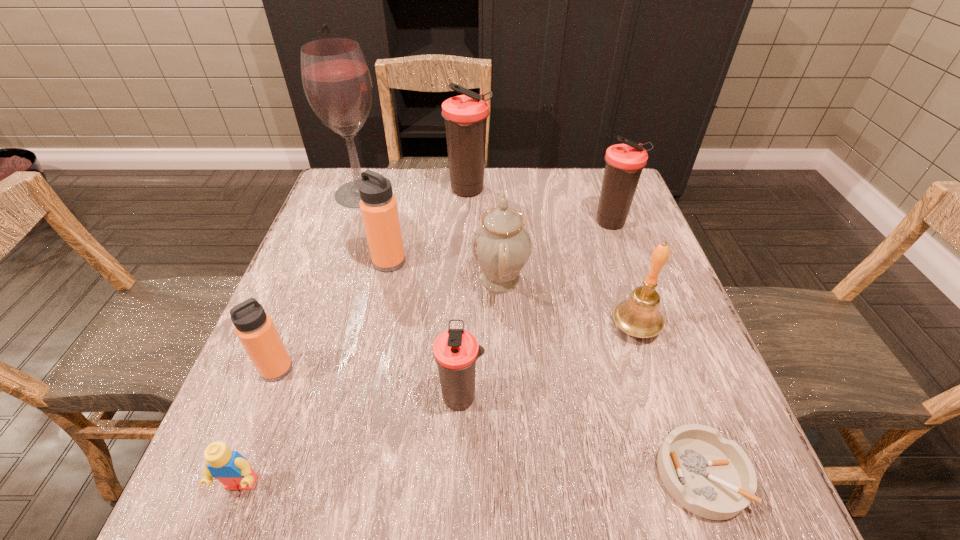
At what (x,y) coordinates should I click in order to perform the action: click on red alcohol. Please return your answer as a coordinate pair (x, y). Looking at the image, I should click on (336, 80).

Identify the location of the tallest object. Image resolution: width=960 pixels, height=540 pixels. (336, 80).

The height and width of the screenshot is (540, 960). I want to click on the farthest thermos bottle, so click(465, 115).

The width and height of the screenshot is (960, 540). I want to click on the ninth shortest object, so pyautogui.click(x=465, y=115).

Locate an element on the screen. the rightmost thermos bottle is located at coordinates (624, 162).

Where is `the rightmost brown thermos bottle`? the rightmost brown thermos bottle is located at coordinates (624, 162).

This screenshot has width=960, height=540. Identify the location of the right orange thermos bottle. (379, 210).

Image resolution: width=960 pixels, height=540 pixels. I want to click on the third farthest thermos bottle, so click(x=379, y=210).

Where is `chinaware`? chinaware is located at coordinates (501, 245).

Locate an element on the screen. The image size is (960, 540). bell is located at coordinates (639, 316).